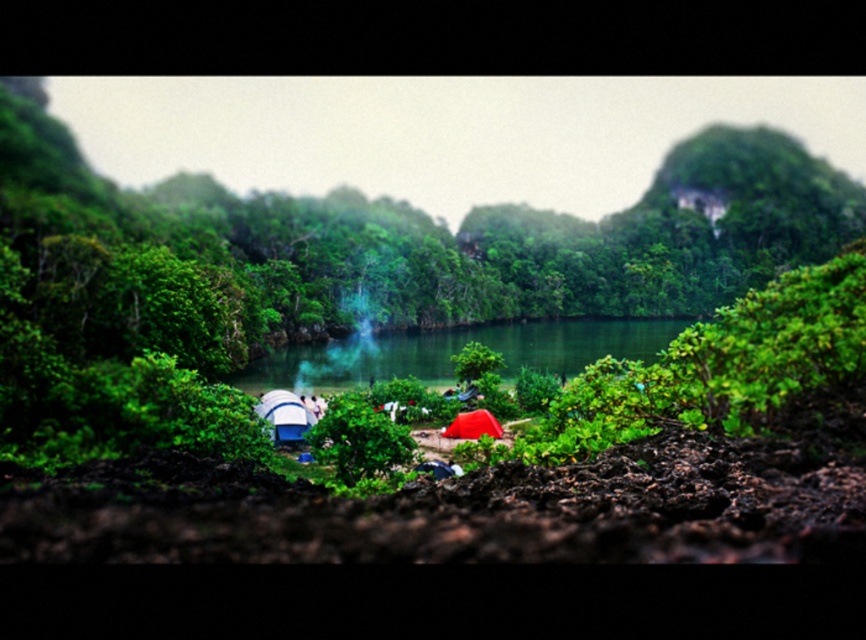
Question: From the image, what is the correct spatial relationship of green leafy bush at center in relation to green smooth water at center?

Choices:
 (A) left
 (B) right

Answer: (B)

Question: Does green leafy bush at center have a smaller size compared to green smooth water at center?

Choices:
 (A) yes
 (B) no

Answer: (B)

Question: Which of the following is the farthest from the observer?

Choices:
 (A) (729, 280)
 (B) (556, 326)

Answer: (A)

Question: Is green leafy bush at center thinner than green smooth water at center?

Choices:
 (A) yes
 (B) no

Answer: (B)